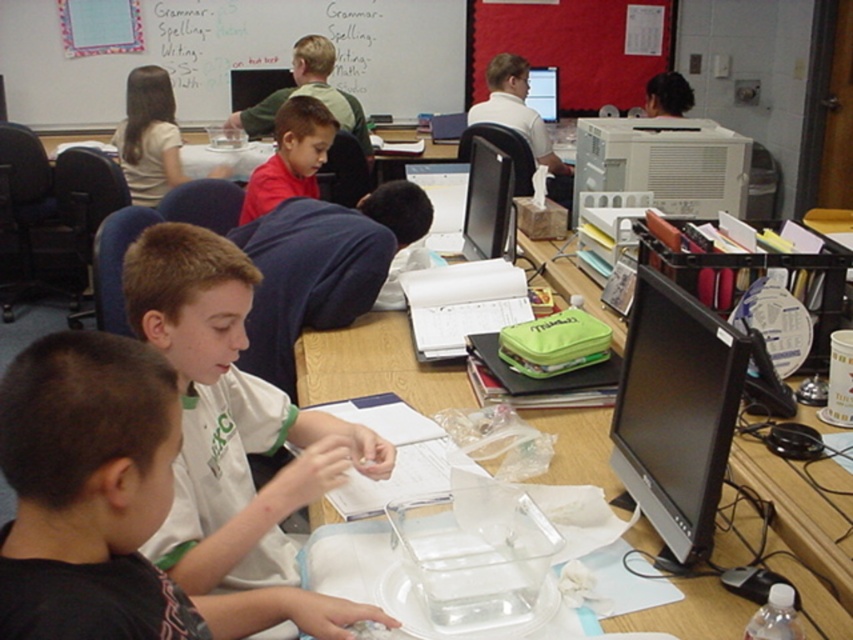
You are a student in the classroom trying to fit both the white matte shirt at center and the black glossy computer monitor at right into a storage box. The box can only accommodate items narrower than the narrower of the two. Which item determines the maximum width the box must have?

The black glossy computer monitor at right is narrower than the white matte shirt at center, so the box must be at least as wide as the black glossy computer monitor at right to fit both items.

You are a student in the classroom and need to access the clear plastic tray at center. However, the white cotton shirt at center is blocking it. Can you move the shirt to access the tray?

The white cotton shirt at center is positioned over the clear plastic tray at center, so you can move the shirt to access the tray.

You are a student in the classroom and need to write down an important note. Which object should you use to write on since it is bigger and more suitable for visibility? Please choose between the whiteboard at upper center and the black glossy computer monitor at right.

The whiteboard at upper center has a larger size compared to the black glossy computer monitor at right, so you should use the whiteboard at upper center to write down the important note for better visibility.